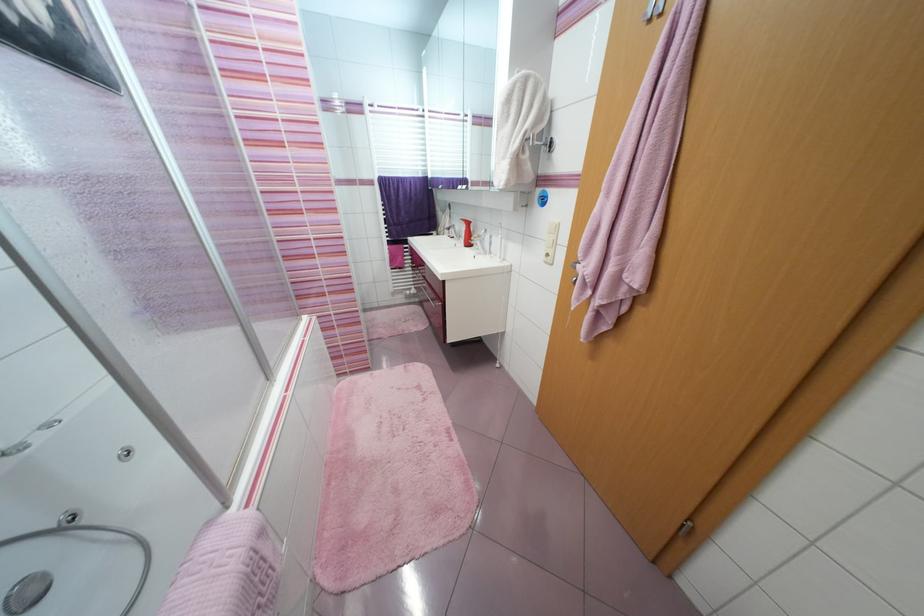
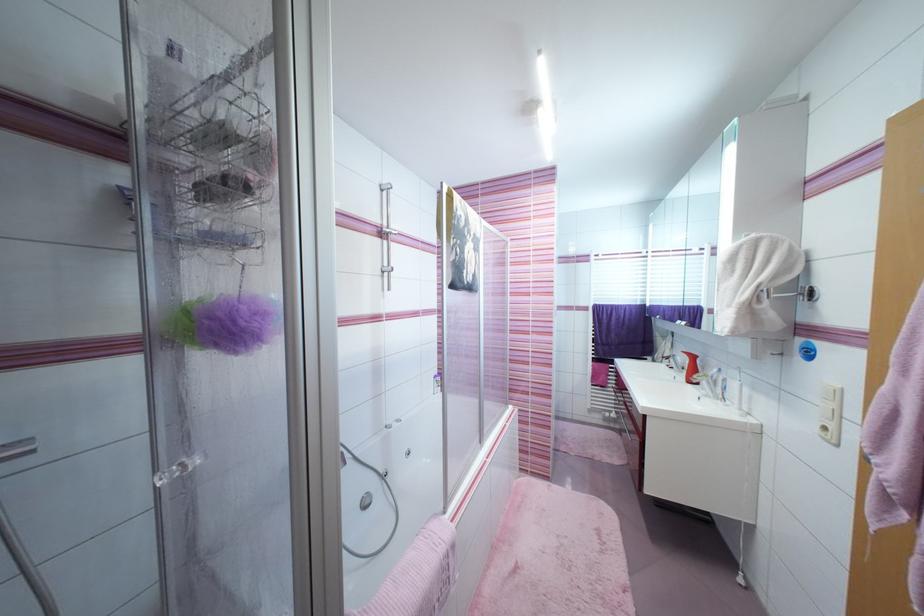
The point at (x=458, y=217) is marked in the first image. Where is the corresponding point in the second image?

(682, 345)